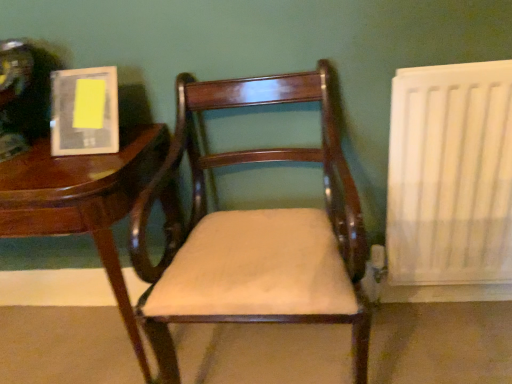
This screenshot has height=384, width=512. Find the location of `vacant space underneath white matte radiator at right (from a real-world perspective)`. vacant space underneath white matte radiator at right (from a real-world perspective) is located at coordinates (442, 309).